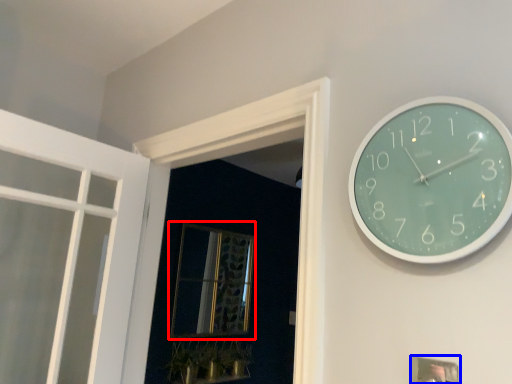
Question: Among these objects, which one is farthest to the camera, window (highlighted by a red box) or picture frame (highlighted by a blue box)?

Choices:
 (A) window
 (B) picture frame

Answer: (A)